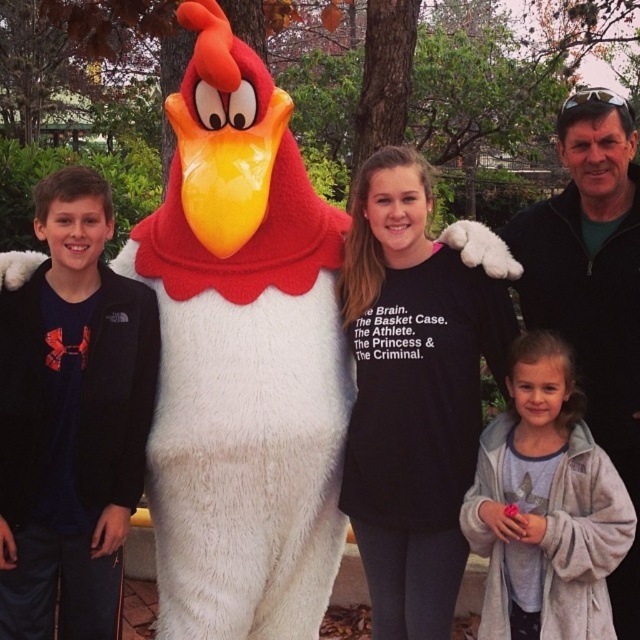
You are a photographer trying to adjust the lighting for the group photo. Since the black cotton shirt at center and the light gray fleece robe at lower right are in the frame, which clothing item should you focus on to ensure proper exposure because it takes up more space?

The black cotton shirt at center should be focused on for proper exposure because its width is larger than the light gray fleece robe at lower right.

You are trying to locate the black cotton shirt at center and the light gray fleece robe at lower right in the photo. Which object is positioned to the left of the other?

The black cotton shirt at center is positioned to the left of the light gray fleece robe at lower right.

Based on the scene description, which clothing item is larger in size between the black cotton shirt at center and the light gray fleece robe at lower right?

The black cotton shirt at center is bigger than the light gray fleece robe at lower right.